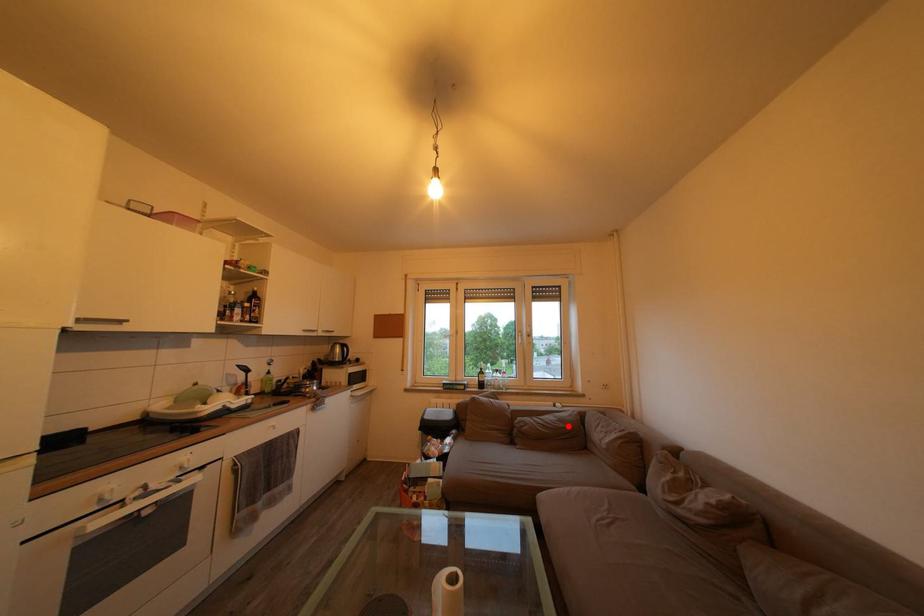
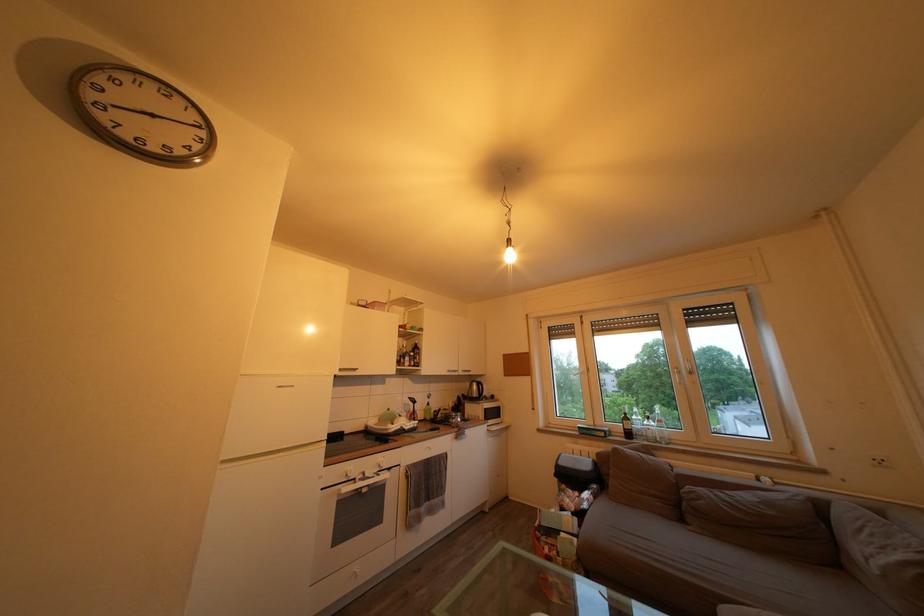
Question: I am providing you with two images of the same scene from different viewpoints. In image1, a red point is highlighted. Considering the same 3D point in image2, which of the following is correct?

Choices:
 (A) It is closer
 (B) It is farther

Answer: (A)